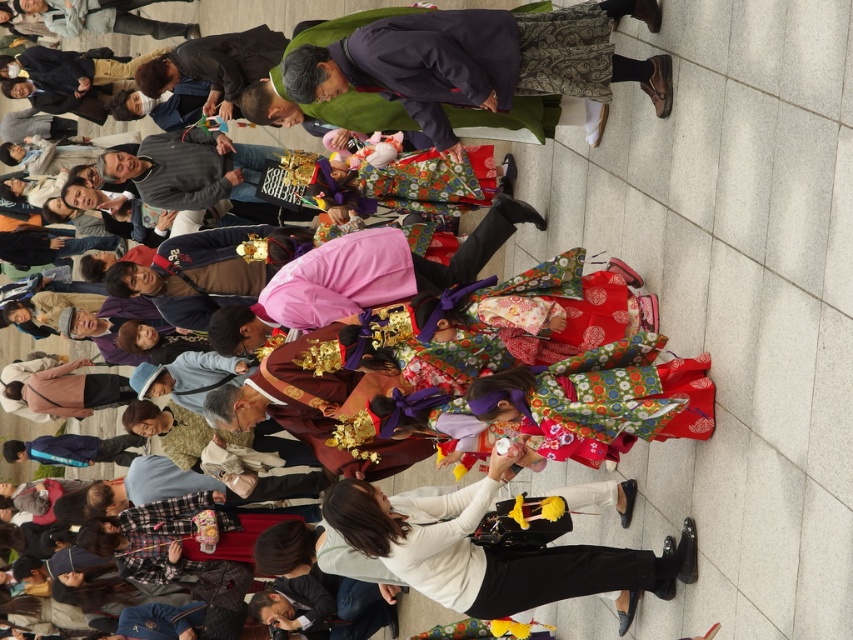
Question: Observing the image, what is the correct spatial positioning of white matte pants at center in reference to pink satin kimono at center?

Choices:
 (A) left
 (B) right

Answer: (B)

Question: Which of the following is the closest to the observer?

Choices:
 (A) white matte pants at center
 (B) pink satin kimono at center

Answer: (A)

Question: From the image, what is the correct spatial relationship of white matte pants at center in relation to pink satin kimono at center?

Choices:
 (A) right
 (B) left

Answer: (A)

Question: Can you confirm if white matte pants at center is smaller than pink satin kimono at center?

Choices:
 (A) yes
 (B) no

Answer: (B)

Question: Which object is farther from the camera taking this photo?

Choices:
 (A) white matte pants at center
 (B) pink satin kimono at center

Answer: (B)